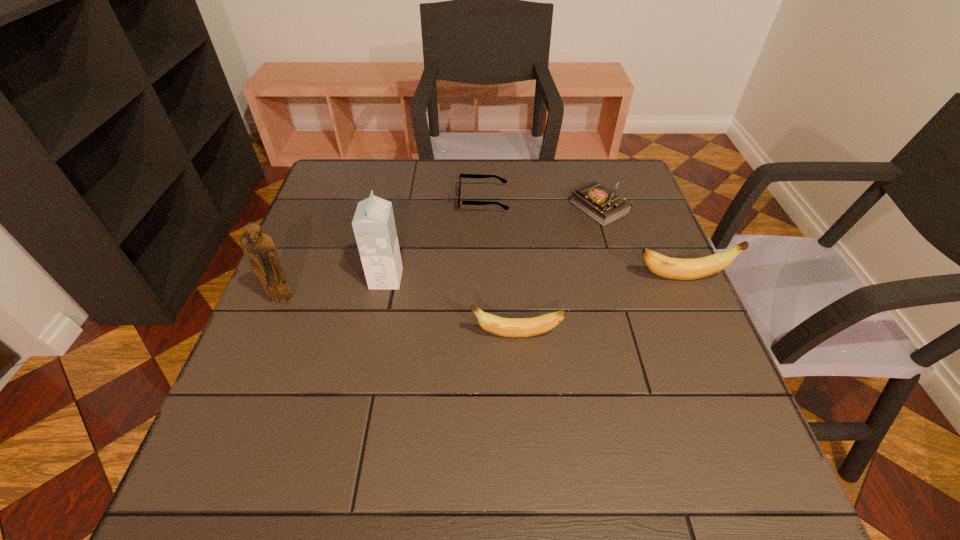
Image resolution: width=960 pixels, height=540 pixels. I want to click on object that is the fifth closest to the right banana, so click(x=259, y=246).

I want to click on vacant area that satisfies the following two spatial constraints: 1. at the stem of the right banana; 2. on the front-facing side of the leftmost object, so click(x=691, y=300).

In order to click on vacant space that satisfies the following two spatial constraints: 1. on the back side of the diary; 2. on the arms of the spectacles in this screenshot , I will do `click(597, 200)`.

The image size is (960, 540). Find the location of `blank space that satisfies the following two spatial constraints: 1. on the arms of the spectacles; 2. on the back side of the diary`. blank space that satisfies the following two spatial constraints: 1. on the arms of the spectacles; 2. on the back side of the diary is located at coordinates (484, 208).

Where is `vacant space that satisfies the following two spatial constraints: 1. on the arms of the diary; 2. on the left side of the spectacles`? This screenshot has height=540, width=960. vacant space that satisfies the following two spatial constraints: 1. on the arms of the diary; 2. on the left side of the spectacles is located at coordinates (484, 208).